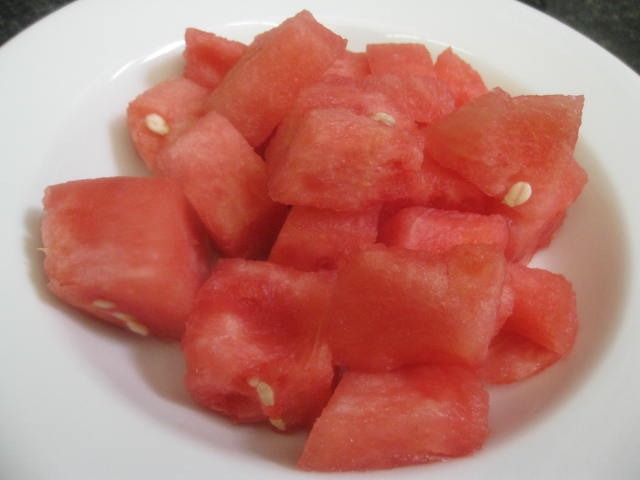
Identify the location of edge of white bowl. (50, 60), (609, 442).